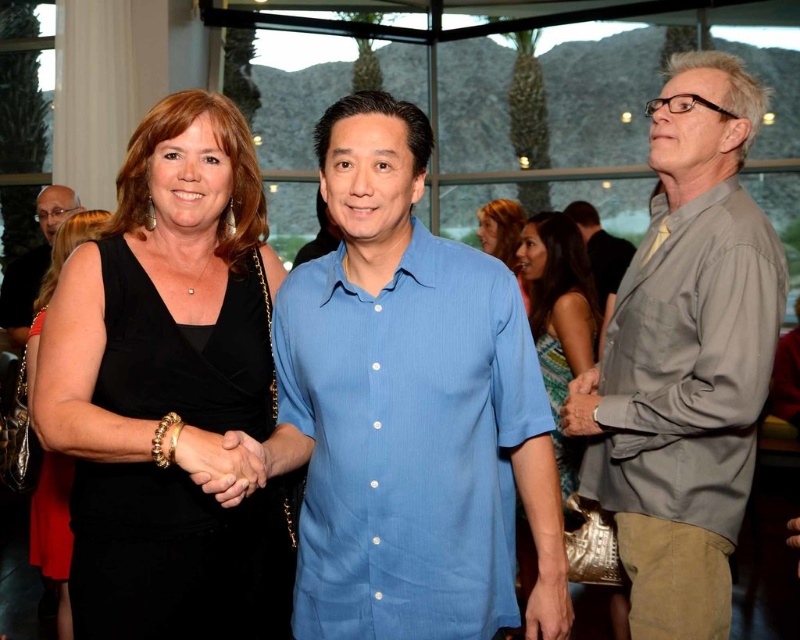
Question: Which object appears closest to the camera in this image?

Choices:
 (A) green textured dress at center
 (B) blue striped shirt at center

Answer: (A)

Question: Is black velvet dress at center bigger than matte black dress at center?

Choices:
 (A) yes
 (B) no

Answer: (A)

Question: Does gray cotton shirt at right have a greater width compared to blue striped shirt at center?

Choices:
 (A) no
 (B) yes

Answer: (B)

Question: Among these objects, which one is farthest from the camera?

Choices:
 (A) black satin dress at left
 (B) green textured dress at center

Answer: (B)

Question: Considering the real-world distances, which object is closest to the blue striped shirt at center?

Choices:
 (A) blue linen shirt at center
 (B) black velvet dress at center
 (C) matte black dress at center
 (D) black satin dress at left

Answer: (C)

Question: Is blue linen shirt at center above black satin dress at left?

Choices:
 (A) yes
 (B) no

Answer: (B)